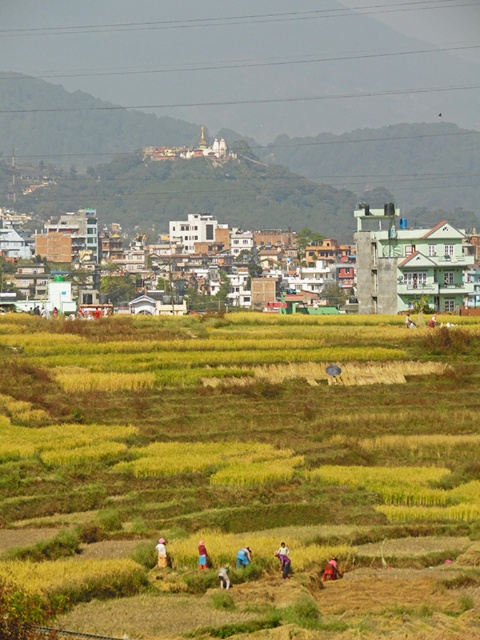
Is blue jeans at lower center to the left of brown fabric person at lower center from the viewer's perspective?

Correct, you'll find blue jeans at lower center to the left of brown fabric person at lower center.

Between blue jeans at lower center and brown fabric person at lower center, which one is positioned higher?

blue jeans at lower center

Who is more distant from viewer, (282, 563) or (331, 570)?

The point (282, 563) is more distant.

Find the location of a particular element. blue jeans at lower center is located at coordinates (283, 557).

Does brown fabric person at lower center appear on the right side of light pink fabric at lower center?

Yes, brown fabric person at lower center is to the right of light pink fabric at lower center.

From the picture: Which of these two, brown fabric person at lower center or light pink fabric at lower center, stands taller?

With more height is light pink fabric at lower center.

What do you see at coordinates (331, 570) in the screenshot? The width and height of the screenshot is (480, 640). I see `brown fabric person at lower center` at bounding box center [331, 570].

Identify the location of brown fabric person at lower center. This screenshot has height=640, width=480. (331, 570).

Can you confirm if blue jeans at lower center is bigger than blue fabric person at center?

Correct, blue jeans at lower center is larger in size than blue fabric person at center.

Who is shorter, blue jeans at lower center or blue fabric person at center?

With less height is blue fabric person at center.

Who is more forward, (274,554) or (250,556)?

Point (250,556) is more forward.

Find the location of a particular element. This screenshot has width=480, height=640. blue jeans at lower center is located at coordinates (283, 557).